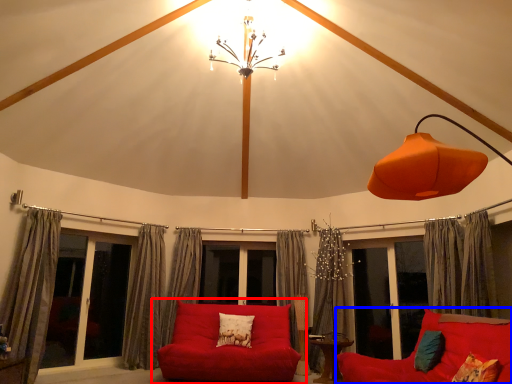
Question: Which object appears farthest to the camera in this image, studio couch (highlighted by a red box) or studio couch (highlighted by a blue box)?

Choices:
 (A) studio couch
 (B) studio couch

Answer: (A)